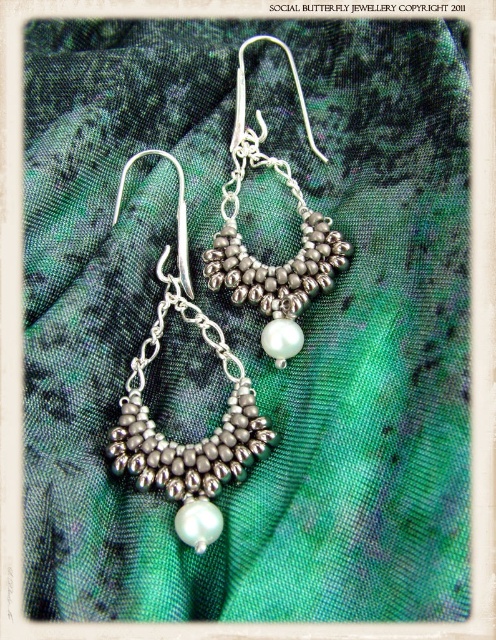
Question: Which object appears farthest from the camera in this image?

Choices:
 (A) silver metallic beads at center
 (B) silver metallic beaded hoop at center

Answer: (B)

Question: In this image, where is silver metallic beads at center located relative to silver metallic beaded hoop at center?

Choices:
 (A) below
 (B) above

Answer: (A)

Question: Which of the following is the closest to the observer?

Choices:
 (A) pyautogui.click(x=245, y=284)
 (B) pyautogui.click(x=213, y=346)

Answer: (B)

Question: From the image, what is the correct spatial relationship of silver metallic beads at center in relation to silver metallic beaded hoop at center?

Choices:
 (A) left
 (B) right

Answer: (A)

Question: Which of the following is the closest to the observer?

Choices:
 (A) (272, 348)
 (B) (114, 451)

Answer: (B)

Question: Does silver metallic beads at center appear on the right side of silver metallic beaded hoop at center?

Choices:
 (A) yes
 (B) no

Answer: (B)